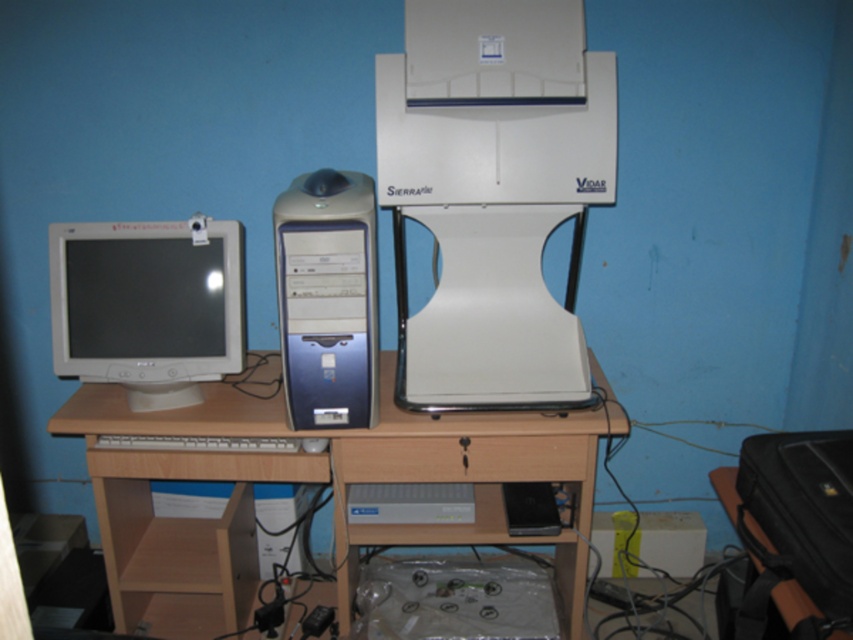
Question: Observing the image, what is the correct spatial positioning of matte white monitor at left in reference to wooden drawer at center?

Choices:
 (A) above
 (B) below

Answer: (A)

Question: Estimate the real-world distances between objects in this image. Which object is closer to the satin silver/black tower at center?

Choices:
 (A) wooden drawer at center
 (B) black plastic computer desk at lower right
 (C) matte white monitor at left
 (D) wooden at center

Answer: (A)

Question: Does wooden at center have a greater width compared to white plastic keyboard at center?

Choices:
 (A) yes
 (B) no

Answer: (A)

Question: Does satin silver/black tower at center have a lesser width compared to black plastic computer desk at lower right?

Choices:
 (A) yes
 (B) no

Answer: (B)

Question: Estimate the real-world distances between objects in this image. Which object is farther from the wooden drawer at center?

Choices:
 (A) white plastic keyboard at center
 (B) black plastic computer desk at lower right

Answer: (B)

Question: Which object is closer to the camera taking this photo?

Choices:
 (A) black plastic computer desk at lower right
 (B) white plastic keyboard at center
 (C) matte white monitor at left

Answer: (A)